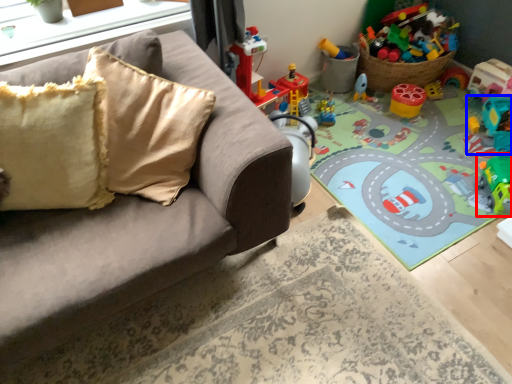
Question: Which of the following is the closest to the observer, toy (highlighted by a red box) or toy (highlighted by a blue box)?

Choices:
 (A) toy
 (B) toy

Answer: (A)